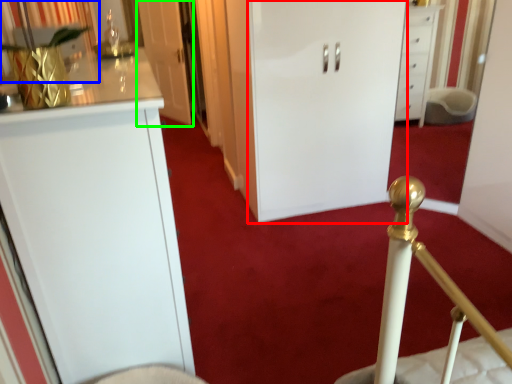
Question: Which is farther away from door (highlighted by a red box)? curtain (highlighted by a blue box) or door (highlighted by a green box)?

Choices:
 (A) curtain
 (B) door

Answer: (B)